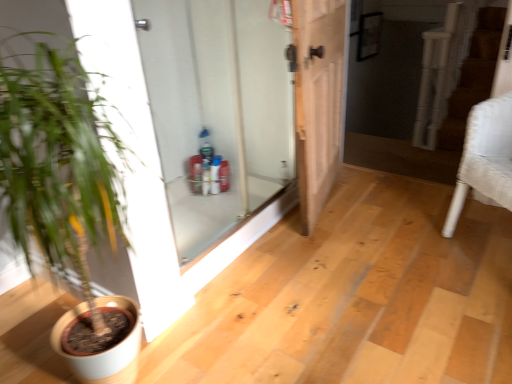
The image size is (512, 384). What are the coordinates of `vacant space situated on the left part of white textured armchair at right` in the screenshot? It's located at click(416, 267).